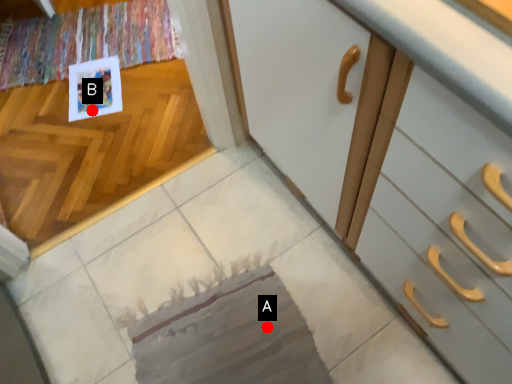
Question: Two points are circled on the image, labeled by A and B beside each circle. Which of the following is the farthest from the observer?

Choices:
 (A) A is further
 (B) B is further

Answer: (B)